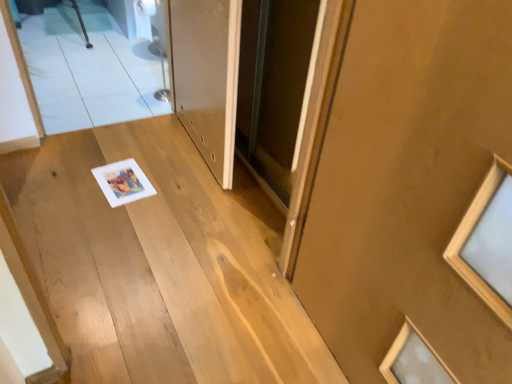
What are the coordinates of `vacant space to the left of matte brown door at center, the 1th door when ordered from front to back` in the screenshot? It's located at pyautogui.click(x=240, y=340).